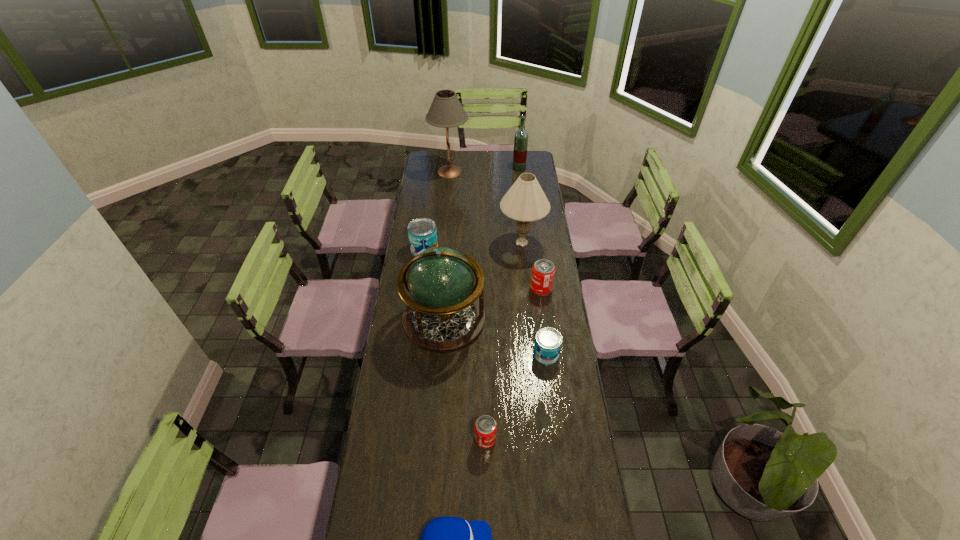
The width and height of the screenshot is (960, 540). In the image, there is a desktop. In order to click on vacant space at the left edge in this screenshot , I will do `click(419, 386)`.

Locate an element on the screen. free space at the right edge is located at coordinates (541, 462).

The image size is (960, 540). I want to click on free space between the farthest can and the tallest object, so coord(437,211).

Image resolution: width=960 pixels, height=540 pixels. I want to click on unoccupied position between the tallest object and the nearer blue can, so click(498, 263).

I want to click on free space that is in between the third farthest can and the table lamp, so click(x=498, y=263).

The height and width of the screenshot is (540, 960). What are the coordinates of `free space between the smaller blue can and the lampshade` in the screenshot? It's located at (534, 298).

This screenshot has height=540, width=960. Identify the location of free area in between the second can from left to right and the liquor. (502, 303).

The height and width of the screenshot is (540, 960). In order to click on empty location between the lampshade and the third nearest can in this screenshot , I will do `click(532, 265)`.

You are a GUI agent. You are given a task and a screenshot of the screen. Output one action in this format:
    pyautogui.click(x=<x>, y=<y>)
    Task: Click on the free area in between the leftmost can and the tallest object
    Image resolution: width=960 pixels, height=540 pixels.
    Given the screenshot: What is the action you would take?
    pyautogui.click(x=437, y=211)

Where is `free space between the nearer blue can and the left red can`? Image resolution: width=960 pixels, height=540 pixels. free space between the nearer blue can and the left red can is located at coordinates (516, 396).